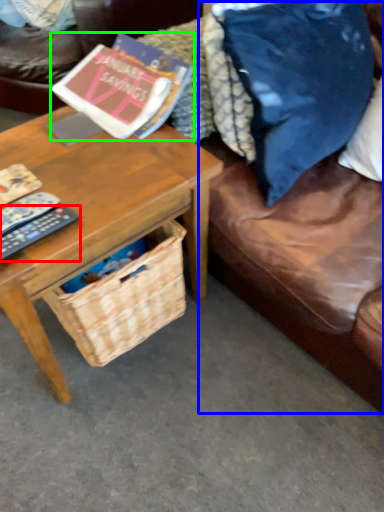
Question: Considering the real-world distances, which object is closest to remote control (highlighted by a red box)? couch (highlighted by a blue box) or book (highlighted by a green box).

Choices:
 (A) couch
 (B) book

Answer: (B)